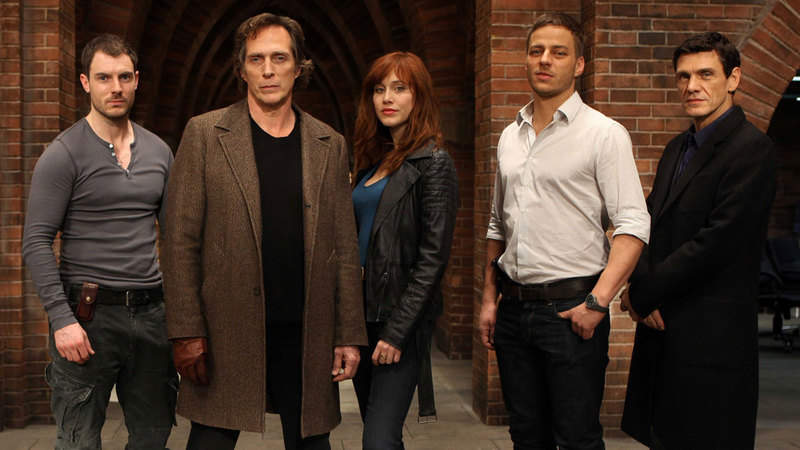
Image resolution: width=800 pixels, height=450 pixels. What are the coordinates of `brick wall` in the screenshot? It's located at (632, 77).